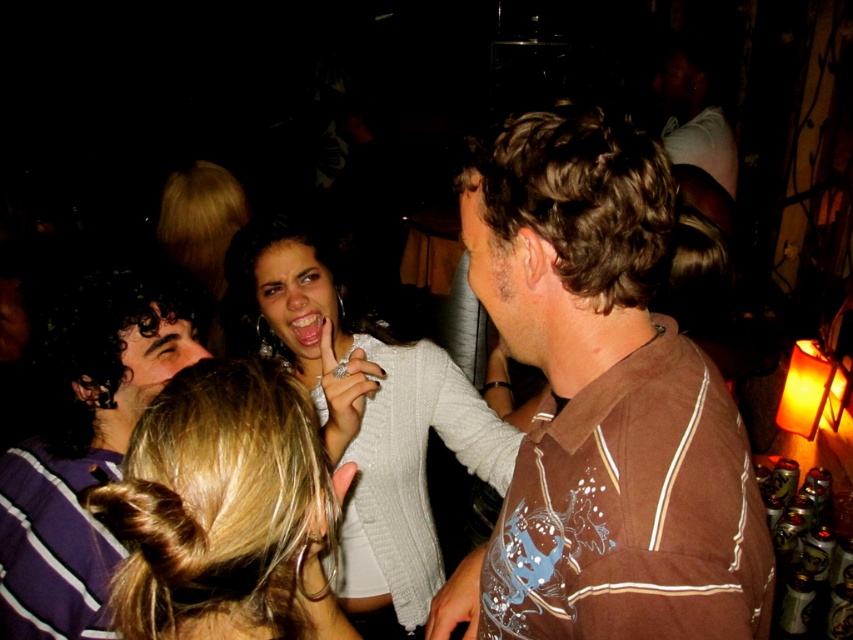
In the image, there is a point labeled as point (363, 406). What object in the scene does this point correspond to?

The point (363, 406) corresponds to the white knitted sweater at center.